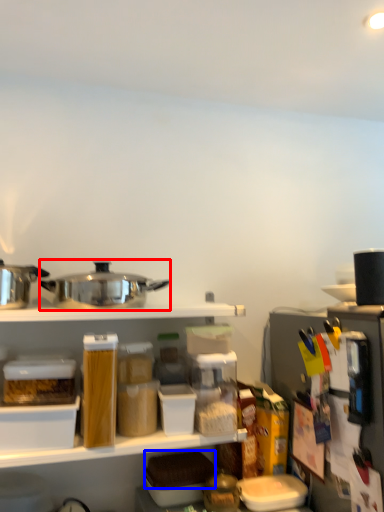
Question: Among these objects, which one is nearest to the camera, appliance (highlighted by a red box) or food (highlighted by a blue box)?

Choices:
 (A) appliance
 (B) food

Answer: (A)